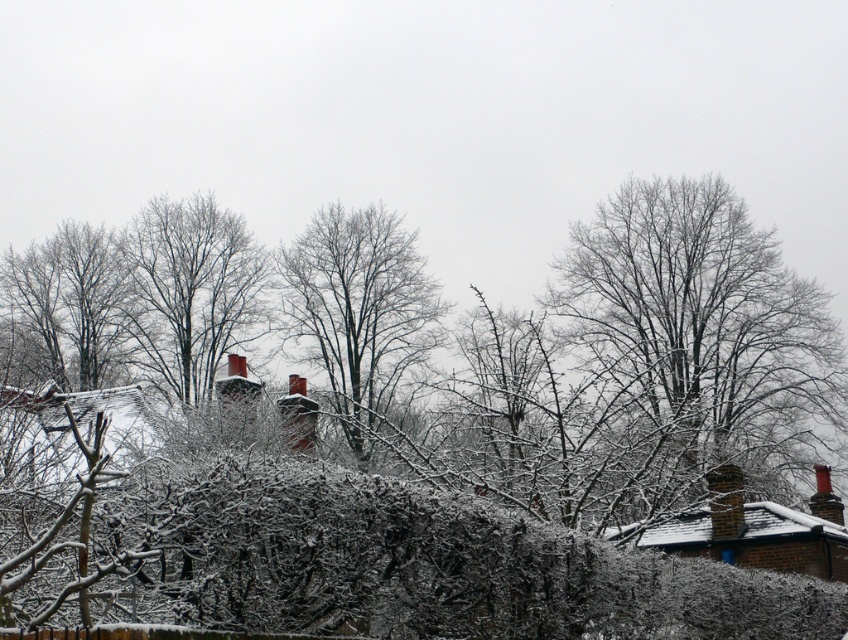
Does bare branches at center have a smaller size compared to bare wood tree at center?

Indeed, bare branches at center has a smaller size compared to bare wood tree at center.

Does point (365, 349) come behind point (233, 288)?

That is False.

Which is behind, point (303, 241) or point (177, 285)?

The point (303, 241) is more distant.

This screenshot has height=640, width=848. In order to click on bare branches at center in this screenshot , I will do `click(358, 308)`.

Between bare branches at upper right and bare wood tree at center, which one is positioned lower?

bare branches at upper right

Who is more distant from viewer, [607,481] or [159,285]?

Positioned behind is point [159,285].

This screenshot has height=640, width=848. I want to click on bare branches at upper right, so click(x=703, y=340).

Between bare branches at upper right and bare branches at center, which one appears on the left side from the viewer's perspective?

From the viewer's perspective, bare branches at center appears more on the left side.

Does bare branches at upper right come behind bare branches at center?

No, bare branches at upper right is closer to the viewer.

Who is more forward, (707, 253) or (410, 337)?

Point (707, 253) is in front.

The image size is (848, 640). Identify the location of bare branches at upper right. (703, 340).